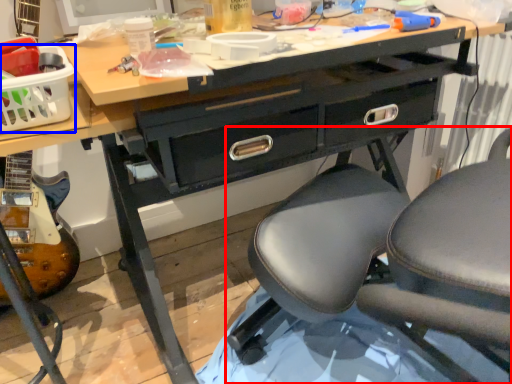
Question: Among these objects, which one is farthest to the camera, chair (highlighted by a red box) or basket (highlighted by a blue box)?

Choices:
 (A) chair
 (B) basket

Answer: (B)